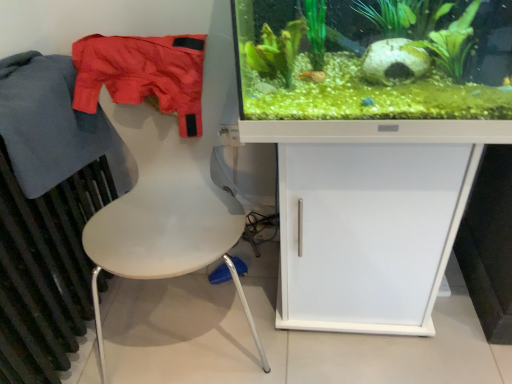
What are the coordinates of `vacant location below white matte chair at left (from a real-world perspective)` in the screenshot? It's located at (196, 317).